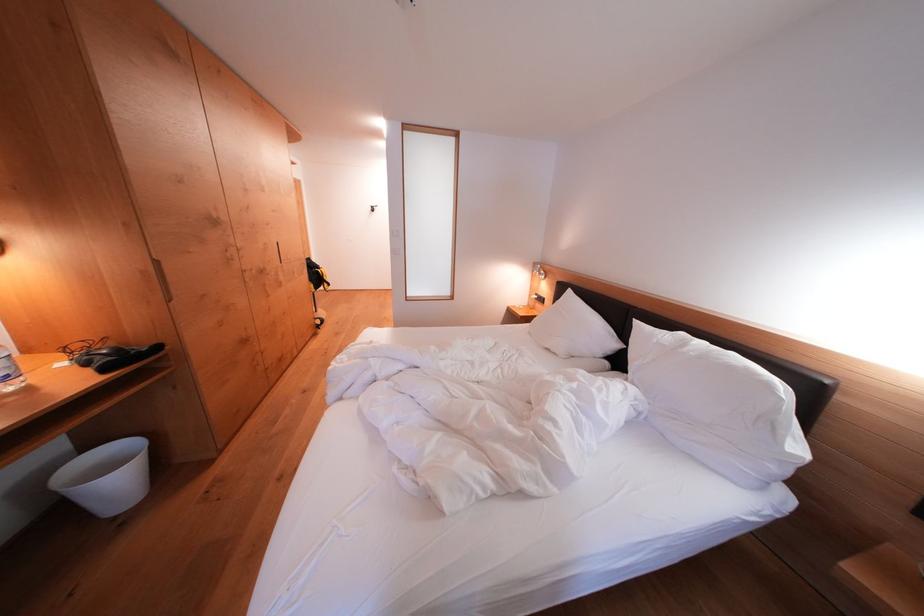
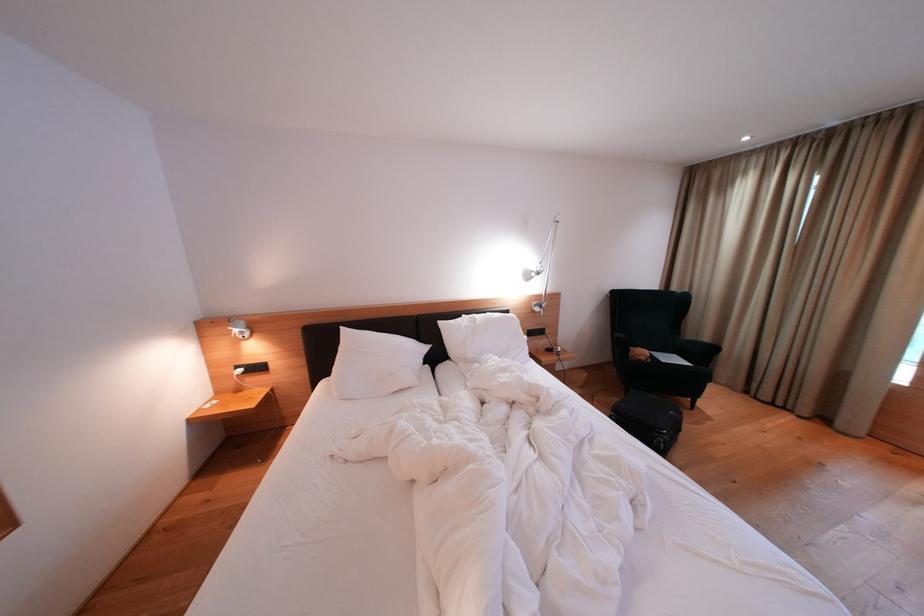
In the second image, find the point that corresponds to point (546, 278) in the first image.

(249, 336)